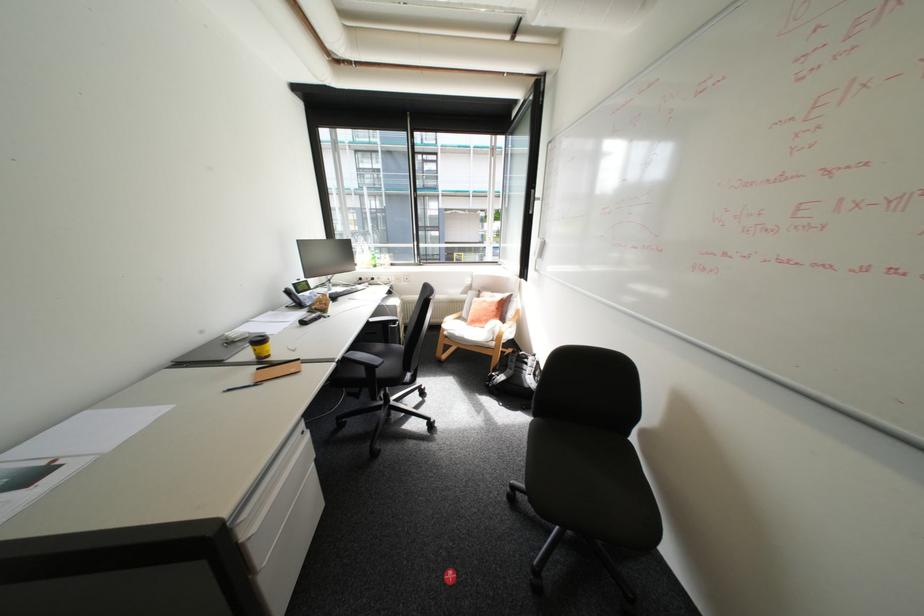
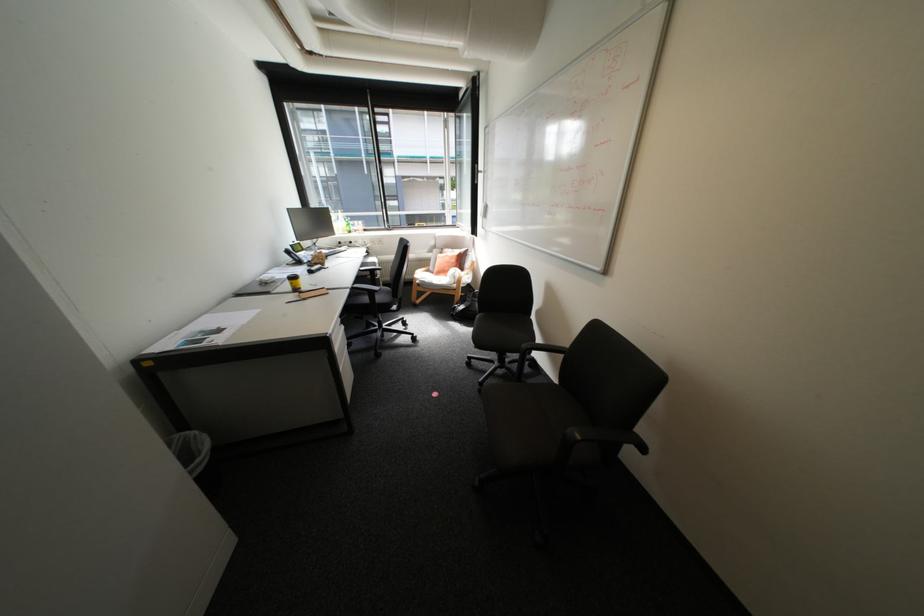
The point at (499, 294) is marked in the first image. Where is the corresponding point in the second image?

(459, 249)